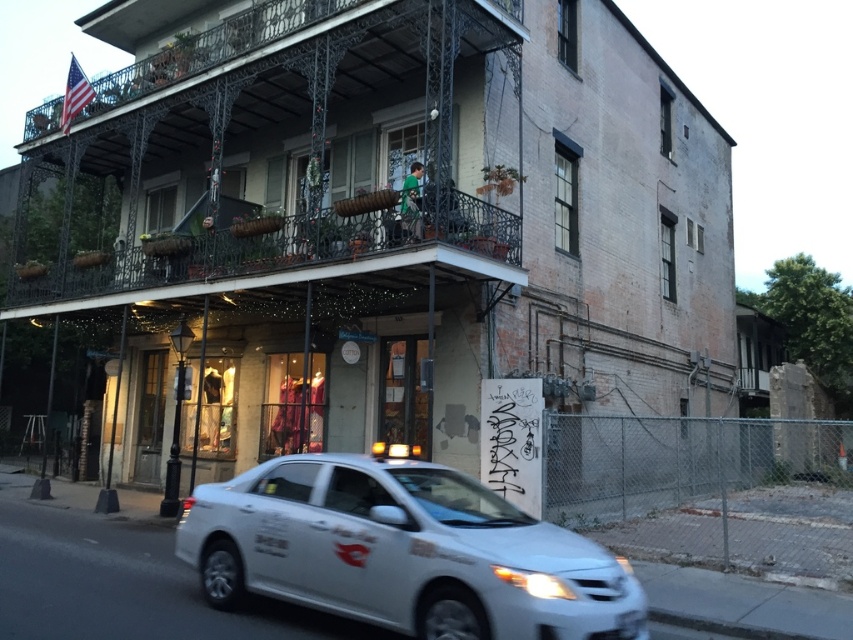
You are driving a white matte car at lower center and want to park it in front of the building. However, there is a black wrought iron balcony at upper center in the way. Can you park the car directly in front of the building without hitting the balcony?

The black wrought iron balcony at upper center is to the left of the white matte car at lower center, so parking the car directly in front of the building would not interfere with the balcony as it is positioned to the side.

You are standing on the sidewalk in front of the two story building. Where is the black wrought iron balcony at upper center located in the image?

The black wrought iron balcony at upper center is located at point (x=248, y=138) in the image.

You are standing on the sidewalk in front of the building and want to locate the point marked as point (x=248, y=138). According to the image, where is this point located?

The point (x=248, y=138) is located on the black wrought iron balcony at upper center of the building.